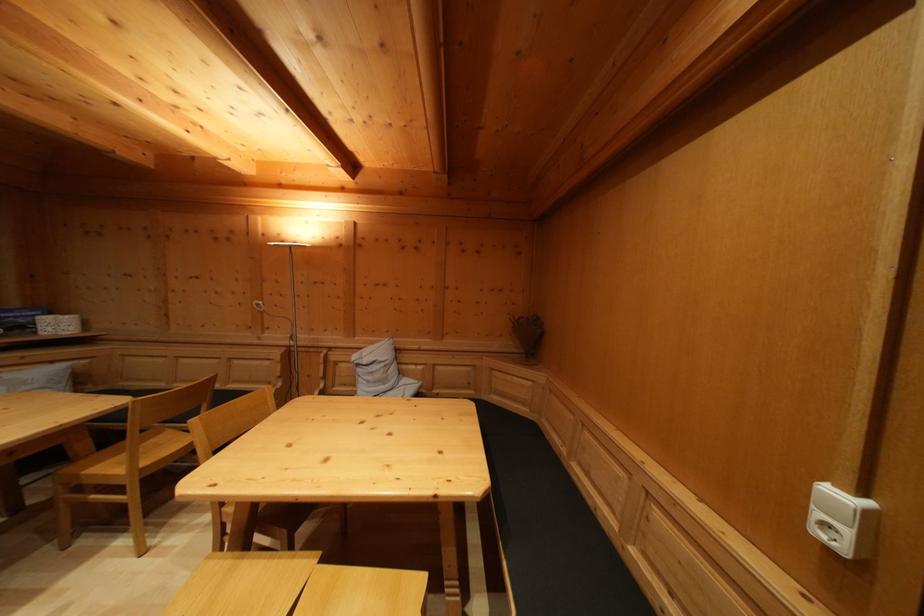
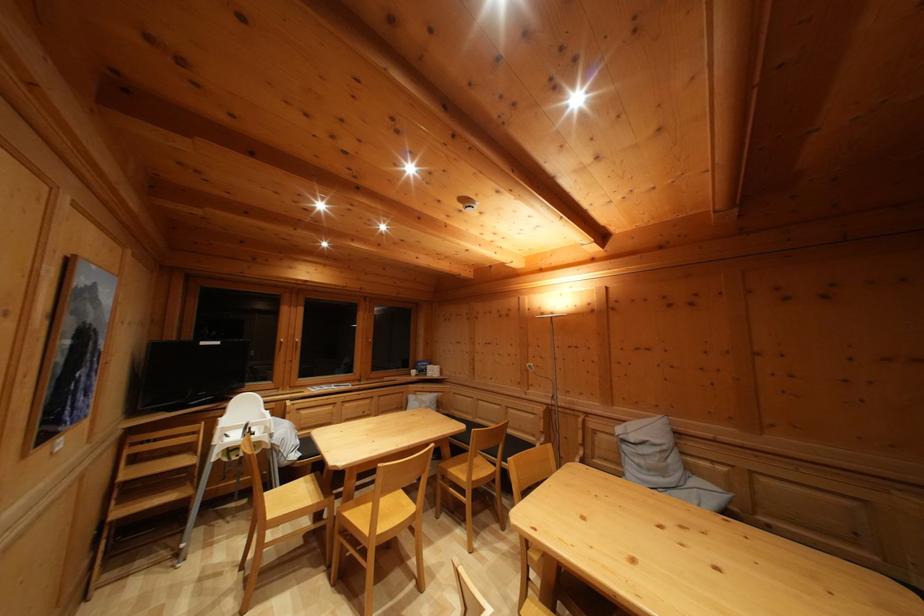
Where in the second image is the point corresponding to (363,377) from the first image?

(629, 454)